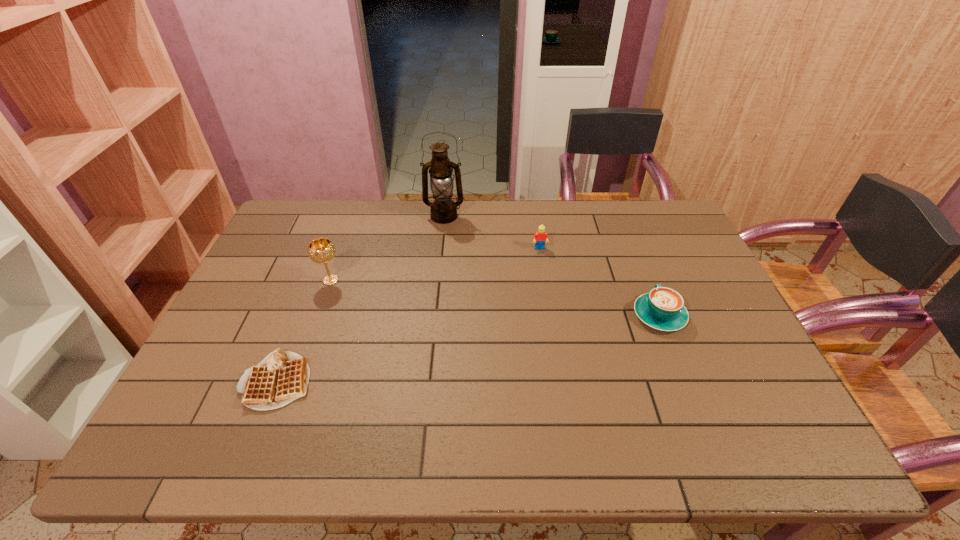
The image size is (960, 540). Find the location of `oil lamp`. oil lamp is located at coordinates (443, 209).

Where is `the farthest object`? This screenshot has width=960, height=540. the farthest object is located at coordinates (443, 209).

Where is `the third nearest object`? the third nearest object is located at coordinates (321, 250).

Locate an element on the screen. Image resolution: width=960 pixels, height=540 pixels. the fourth shortest object is located at coordinates coord(321,250).

Image resolution: width=960 pixels, height=540 pixels. Identify the location of Lego. (540, 236).

Locate an element on the screen. This screenshot has height=540, width=960. the second farthest object is located at coordinates (540, 236).

Where is `the fourth farthest object`? This screenshot has height=540, width=960. the fourth farthest object is located at coordinates (663, 308).

Locate an element on the screen. the rightmost object is located at coordinates (663, 308).

The height and width of the screenshot is (540, 960). Identify the location of waffle. (281, 377).

Find the location of `the nearest object`. the nearest object is located at coordinates (281, 377).